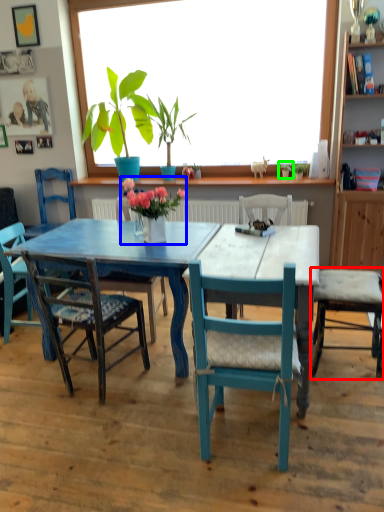
Question: Estimate the real-world distances between objects in this image. Which object is farther from chair (highlighted by a red box), houseplant (highlighted by a blue box) or houseplant (highlighted by a green box)?

Choices:
 (A) houseplant
 (B) houseplant

Answer: (B)